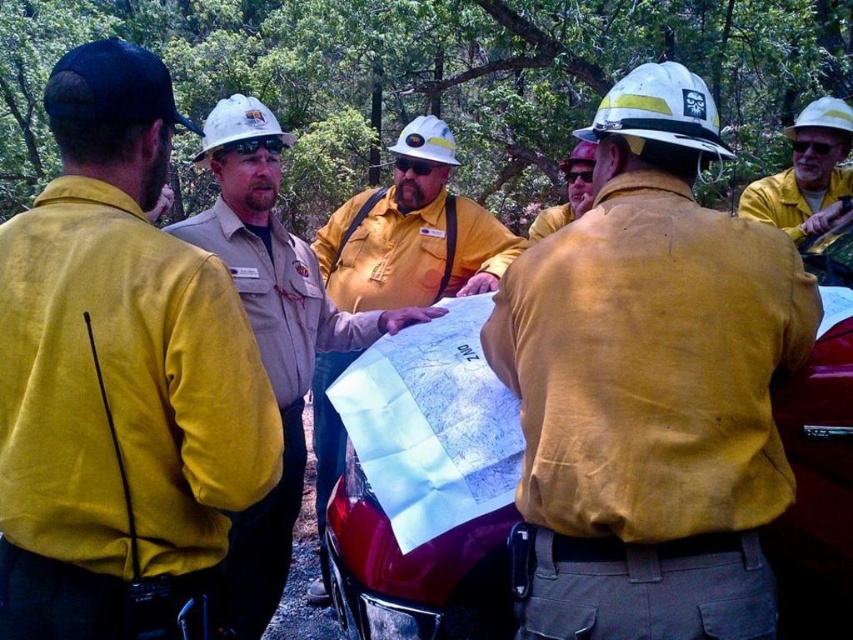
Question: Does matte yellow shirt at center have a larger size compared to white hard hat at center?

Choices:
 (A) no
 (B) yes

Answer: (B)

Question: Which object is the closest to the yellow canvas shirt at upper left?

Choices:
 (A) matte red car at center
 (B) yellow hard hat at upper right
 (C) matte yellow safety vest at center
 (D) white hard hat at upper center

Answer: (A)

Question: Among these points, which one is farthest from the camera?

Choices:
 (A) (70, 556)
 (B) (235, 122)
 (C) (421, 120)
 (D) (567, 156)

Answer: (D)

Question: Can you confirm if yellow canvas shirt at upper left is wider than white hard hat at upper right?

Choices:
 (A) yes
 (B) no

Answer: (A)

Question: Which point is farther to the camera?

Choices:
 (A) (589, 154)
 (B) (564, 172)
 (C) (708, 96)

Answer: (B)

Question: Can you confirm if matte red car at center is positioned below yellow hard hat at upper right?

Choices:
 (A) yes
 (B) no

Answer: (A)